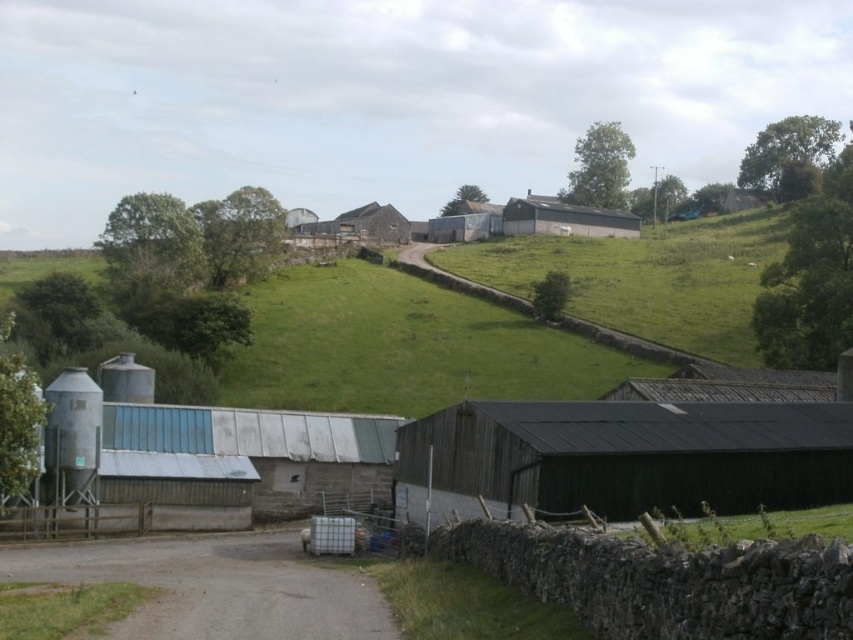
Which of these two, dark green corrugated metal barn at center-right or green grassy hillside at upper center, stands shorter?

dark green corrugated metal barn at center-right is shorter.

You are a GUI agent. You are given a task and a screenshot of the screen. Output one action in this format:
    pyautogui.click(x=<x>, y=<y>)
    Task: Click on the dark green corrugated metal barn at center-right
    This screenshot has height=640, width=853.
    Given the screenshot: What is the action you would take?
    pyautogui.click(x=624, y=458)

Where is `dark green corrugated metal barn at center-right`? The width and height of the screenshot is (853, 640). dark green corrugated metal barn at center-right is located at coordinates (624, 458).

Identify the location of dark green corrugated metal barn at center-right. (624, 458).

What do you see at coordinates (624, 458) in the screenshot? I see `dark green corrugated metal barn at center-right` at bounding box center [624, 458].

Who is positioned more to the right, dark green corrugated metal barn at center-right or gray gravel road at lower left?

dark green corrugated metal barn at center-right

Between point (770, 424) and point (3, 568), which one is positioned behind?

The point (770, 424) is behind.

The height and width of the screenshot is (640, 853). In order to click on dark green corrugated metal barn at center-right in this screenshot , I will do `click(624, 458)`.

Is gray gravel road at lower left further to the viewer compared to metallic silo at left?

That is False.

The width and height of the screenshot is (853, 640). Describe the element at coordinates (216, 586) in the screenshot. I see `gray gravel road at lower left` at that location.

Who is more forward, (15, 566) or (49, 454)?

Point (15, 566)

Where is `gray gravel road at lower left`? The height and width of the screenshot is (640, 853). gray gravel road at lower left is located at coordinates (216, 586).